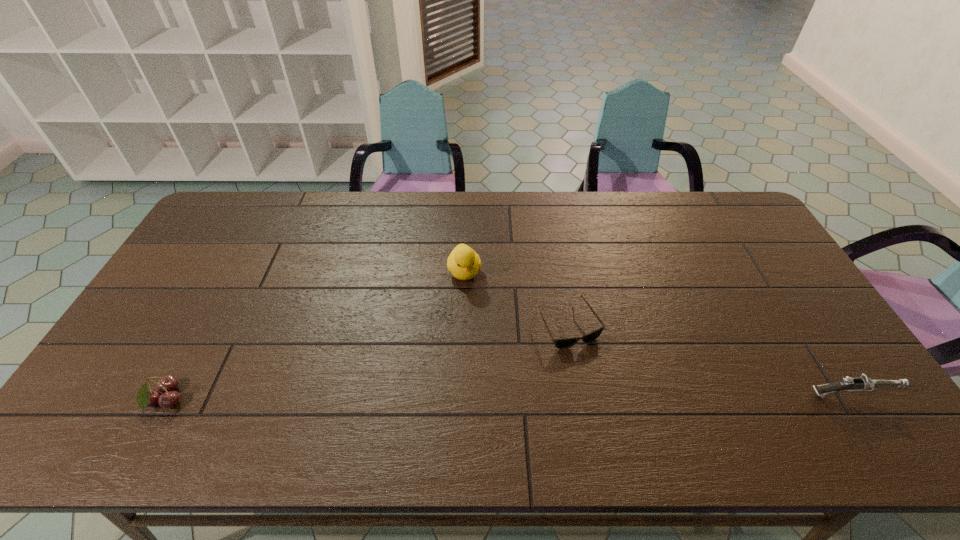
I want to click on free space on the desktop that is between the cherry and the gun and is positioned on the front-facing side of the farthest object, so click(495, 398).

What are the coordinates of `free space on the desktop that is between the leftmost object and the rightmost object and is positioned on the lenses of the sunglasses` in the screenshot? It's located at (610, 397).